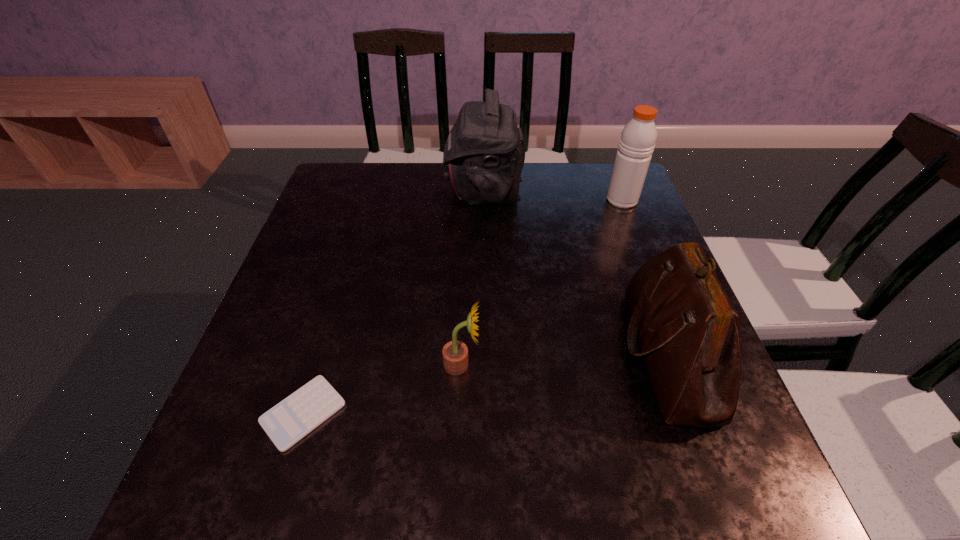
Where is `vacant area situated 0.340m on the left of the right shoulder bag`? This screenshot has width=960, height=540. vacant area situated 0.340m on the left of the right shoulder bag is located at coordinates (453, 353).

Locate an element on the screen. vacant point located 0.310m on the face of the second shortest object is located at coordinates (639, 364).

The width and height of the screenshot is (960, 540). I want to click on vacant space situated 0.320m on the back of the leftmost object, so click(349, 262).

Where is `shoulder bag that is at the far edge`? This screenshot has width=960, height=540. shoulder bag that is at the far edge is located at coordinates (484, 154).

Image resolution: width=960 pixels, height=540 pixels. I want to click on shaker located at the far edge, so click(637, 142).

At what (x,y) coordinates should I click in order to perform the action: click on object that is at the left edge. Please return your answer as a coordinate pair (x, y). Looking at the image, I should click on (293, 418).

Find the location of a particular element. shaker that is at the right edge is located at coordinates (637, 142).

Locate an element on the screen. The width and height of the screenshot is (960, 540). shoulder bag located in the right edge section of the desktop is located at coordinates (689, 333).

Find the location of a particular element. Image resolution: width=960 pixels, height=540 pixels. object that is at the far right corner is located at coordinates (637, 142).

The height and width of the screenshot is (540, 960). I want to click on free space at the far edge, so click(419, 172).